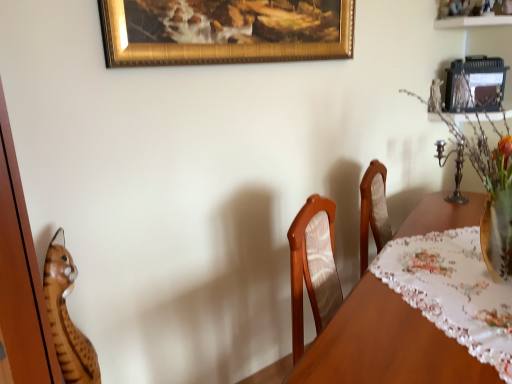
Question: Should I look upward or downward to see gold textured frame at upper center?

Choices:
 (A) down
 (B) up

Answer: (B)

Question: Is translucent glass vase with colorful flowers at right thinner than wooden table at center?

Choices:
 (A) yes
 (B) no

Answer: (A)

Question: Considering the relative sizes of translucent glass vase with colorful flowers at right and wooden table at center in the image provided, is translucent glass vase with colorful flowers at right wider than wooden table at center?

Choices:
 (A) no
 (B) yes

Answer: (A)

Question: Is wooden table at center inside translucent glass vase with colorful flowers at right?

Choices:
 (A) no
 (B) yes

Answer: (A)

Question: Is translucent glass vase with colorful flowers at right to the right of wooden table at center from the viewer's perspective?

Choices:
 (A) no
 (B) yes

Answer: (B)

Question: Could you tell me if translucent glass vase with colorful flowers at right is facing wooden table at center?

Choices:
 (A) no
 (B) yes

Answer: (A)

Question: Are translucent glass vase with colorful flowers at right and wooden table at center far apart?

Choices:
 (A) no
 (B) yes

Answer: (A)

Question: Considering the relative sizes of translucent glass vase with colorful flowers at right and gold textured frame at upper center in the image provided, is translucent glass vase with colorful flowers at right wider than gold textured frame at upper center?

Choices:
 (A) yes
 (B) no

Answer: (A)

Question: Is translucent glass vase with colorful flowers at right looking in the opposite direction of gold textured frame at upper center?

Choices:
 (A) no
 (B) yes

Answer: (B)

Question: Is the depth of translucent glass vase with colorful flowers at right greater than that of gold textured frame at upper center?

Choices:
 (A) yes
 (B) no

Answer: (B)

Question: From a real-world perspective, does translucent glass vase with colorful flowers at right stand above gold textured frame at upper center?

Choices:
 (A) yes
 (B) no

Answer: (B)

Question: Can you confirm if translucent glass vase with colorful flowers at right is shorter than gold textured frame at upper center?

Choices:
 (A) yes
 (B) no

Answer: (B)

Question: Is translucent glass vase with colorful flowers at right not within gold textured frame at upper center?

Choices:
 (A) no
 (B) yes

Answer: (B)

Question: Considering the relative sizes of wooden tiger at left and translucent glass vase with colorful flowers at right in the image provided, is wooden tiger at left wider than translucent glass vase with colorful flowers at right?

Choices:
 (A) yes
 (B) no

Answer: (B)